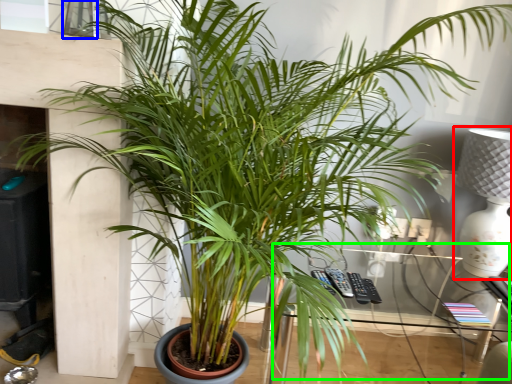
Question: Which object is the farthest from table lamp (highlighted by a red box)? Choose among these: window (highlighted by a blue box) or table (highlighted by a green box).

Choices:
 (A) window
 (B) table

Answer: (A)